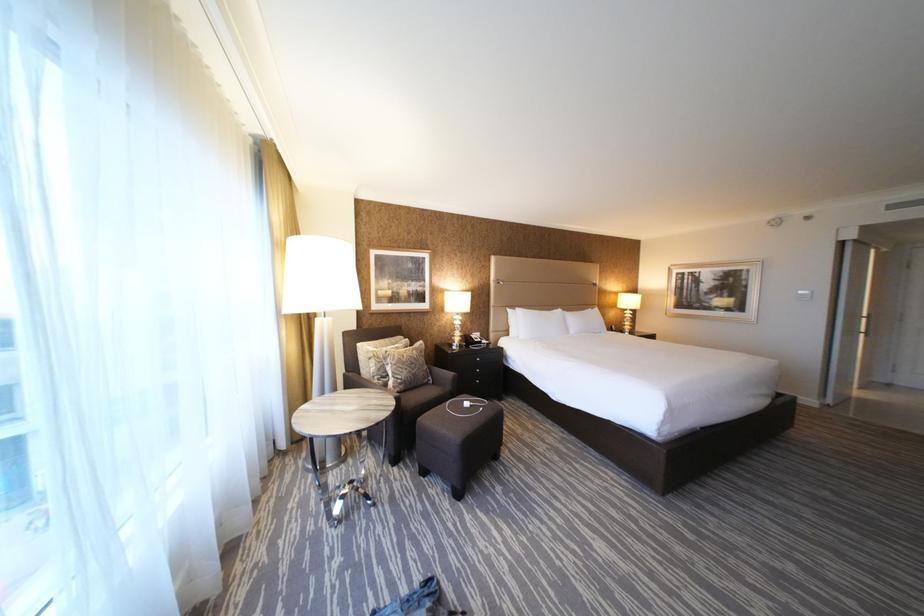
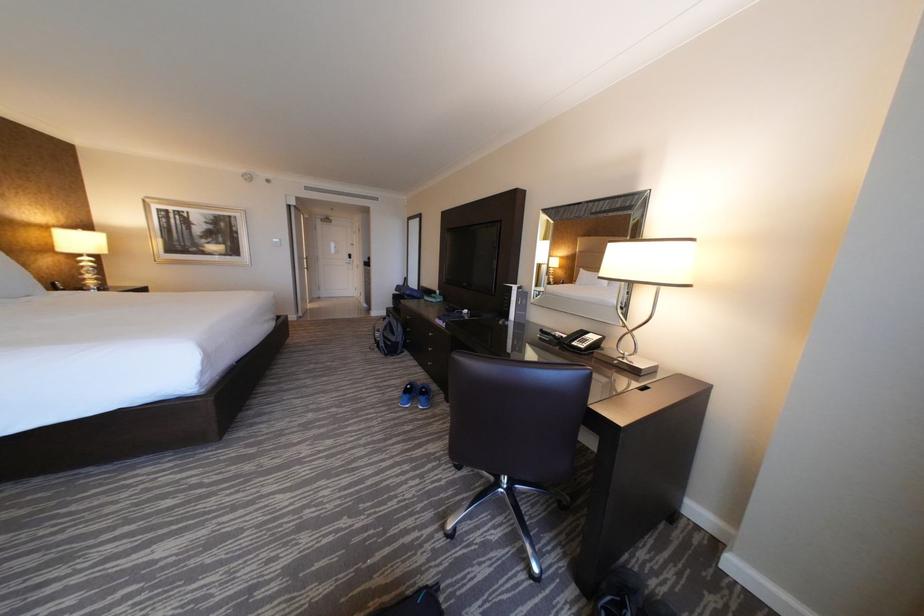
Question: The camera is either moving clockwise (left) or counter-clockwise (right) around the object. The first image is from the beginning of the video and the second image is from the end. Is the camera moving left or right when shooting the video?

Choices:
 (A) Left
 (B) Right

Answer: (A)